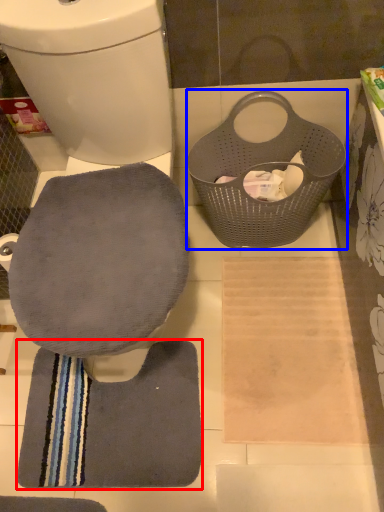
Question: Which of the following is the closest to the observer, bath towel (highlighted by a red box) or laundry basket (highlighted by a blue box)?

Choices:
 (A) bath towel
 (B) laundry basket

Answer: (B)